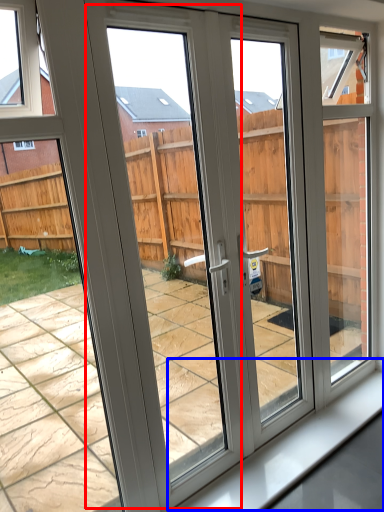
Question: Which object appears farthest to the camera in this image, screen door (highlighted by a red box) or window sill (highlighted by a blue box)?

Choices:
 (A) screen door
 (B) window sill

Answer: (B)